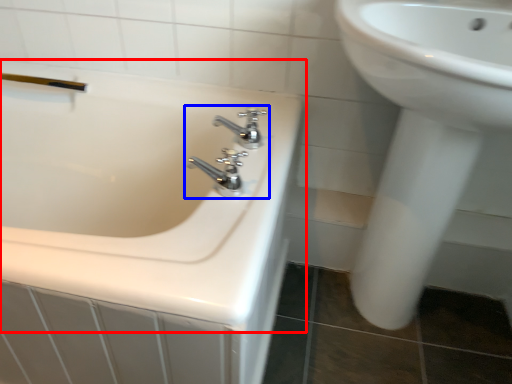
Question: Which object is further to the camera taking this photo, bathtub (highlighted by a red box) or tap (highlighted by a blue box)?

Choices:
 (A) bathtub
 (B) tap

Answer: (B)